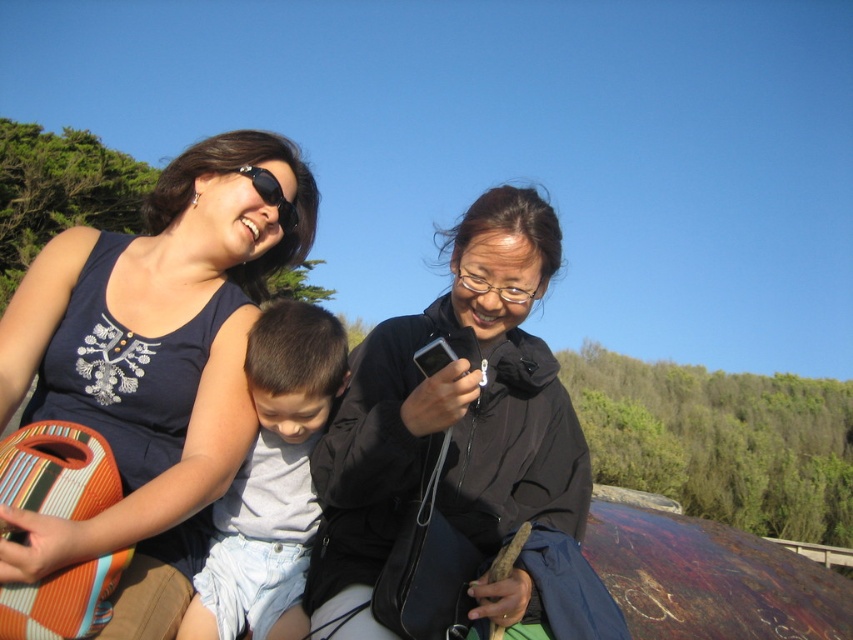
You are a fashion designer observing the matte black tank top at upper left and the black matte sunglasses at upper center in the image. Which item has a greater width?

The matte black tank top at upper left has a greater width than the black matte sunglasses at upper center.

You are standing at the center of the scene and want to hand a small object to the person wearing the matte black tank top at upper left without moving. Can you do it?

The person wearing the matte black tank top at upper left is 1.90 meters away from you, so you cannot reach them without moving since the distance is too far.